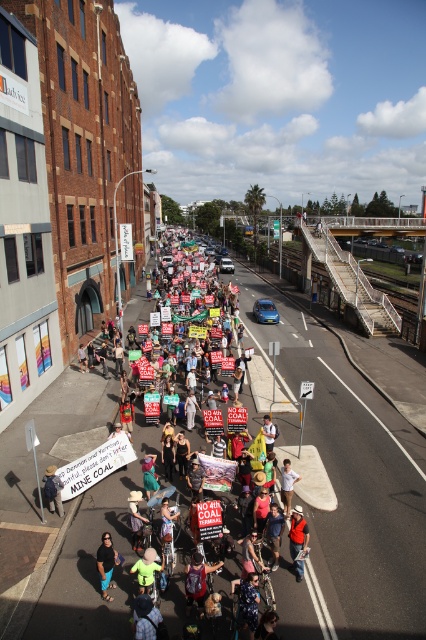
Question: Among these objects, which one is farthest from the camera?

Choices:
 (A) multicolored fabric crowd at center
 (B) red shirt at center
 (C) white cotton dress at center

Answer: (C)

Question: Is red shirt at center to the left of green fabric shirt at lower center from the viewer's perspective?

Choices:
 (A) yes
 (B) no

Answer: (B)

Question: Can you confirm if green fabric shirt at lower center is wider than white cotton dress at center?

Choices:
 (A) yes
 (B) no

Answer: (A)

Question: Does red shirt at center have a smaller size compared to yellow straw hat at center?

Choices:
 (A) no
 (B) yes

Answer: (B)

Question: Which of the following is the closest to the observer?

Choices:
 (A) (186, 412)
 (B) (147, 592)
 (C) (291, 544)

Answer: (B)

Question: Among these points, which one is farthest from the camera?

Choices:
 (A) (187, 422)
 (B) (284, 515)
 (C) (152, 564)
 (D) (100, 582)

Answer: (A)